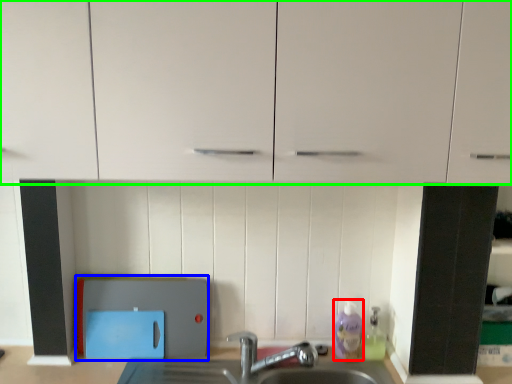
Question: Considering the real-world distances, which object is closest to cleaning product (highlighted by a red box)? appliance (highlighted by a blue box) or cabinetry (highlighted by a green box).

Choices:
 (A) appliance
 (B) cabinetry

Answer: (A)